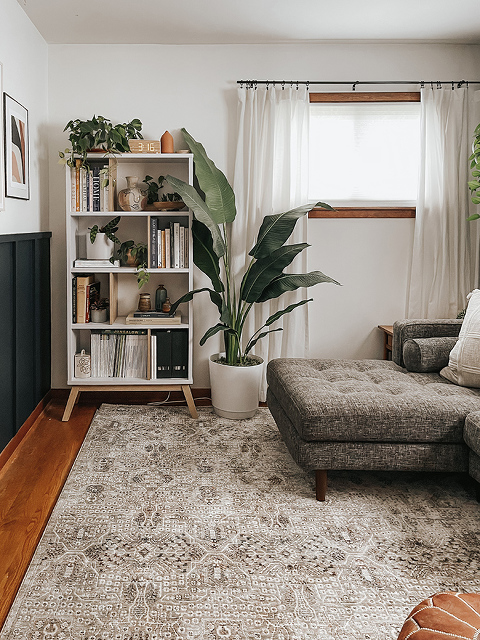
Locate an element on the screen. This screenshot has height=640, width=480. clock is located at coordinates (144, 148).